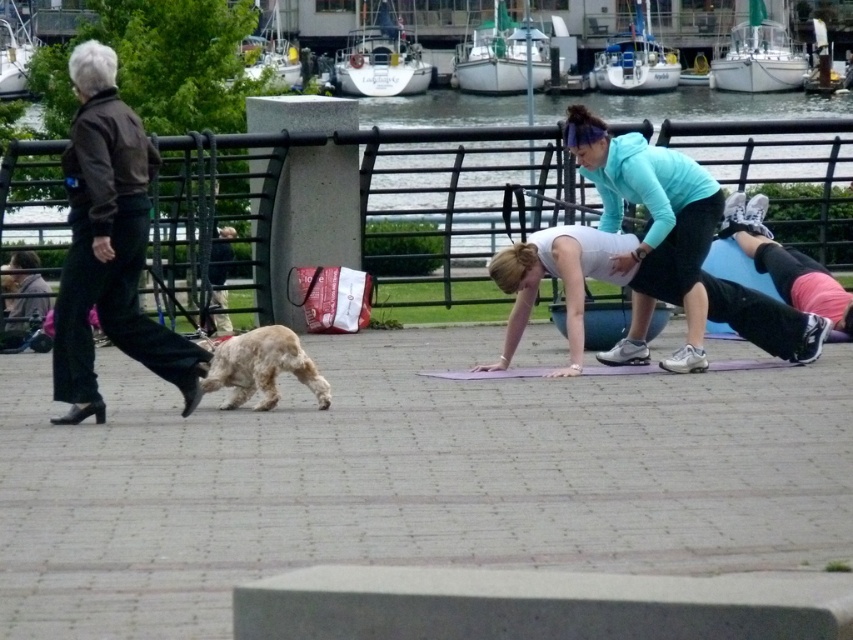
Question: Can you confirm if light brown fur at lower left is wider than purple rubber yoga mat at center?

Choices:
 (A) no
 (B) yes

Answer: (A)

Question: Among these points, which one is farthest from the camera?

Choices:
 (A) (457, 372)
 (B) (250, 353)
 (C) (641, 349)

Answer: (C)

Question: Is white matte yoga mat at center wider than purple rubber yoga mat at center?

Choices:
 (A) no
 (B) yes

Answer: (B)

Question: Considering the real-world distances, which object is closest to the white matte yoga mat at center?

Choices:
 (A) light brown fur at lower left
 (B) purple rubber yoga mat at center
 (C) teal fleece jacket at center

Answer: (B)

Question: Does white matte yoga mat at center have a larger size compared to purple rubber yoga mat at center?

Choices:
 (A) no
 (B) yes

Answer: (B)

Question: Considering the real-world distances, which object is farthest from the purple rubber yoga mat at center?

Choices:
 (A) teal fleece jacket at center
 (B) white matte yoga mat at center

Answer: (A)